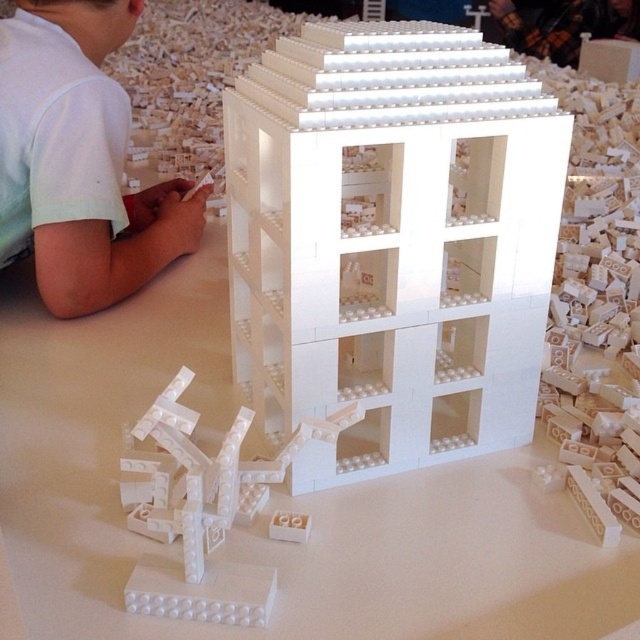
Question: Which point is closer to the camera?

Choices:
 (A) white plastic building at center
 (B) white matte shirt at upper left

Answer: (A)

Question: Where is white plastic building at center located in relation to white matte shirt at upper left in the image?

Choices:
 (A) below
 (B) above

Answer: (A)

Question: Which of the following is the farthest from the observer?

Choices:
 (A) white matte shirt at upper left
 (B) white plastic building at center

Answer: (A)

Question: Does white plastic building at center appear under white matte shirt at upper left?

Choices:
 (A) no
 (B) yes

Answer: (B)

Question: Is white plastic building at center wider than white matte shirt at upper left?

Choices:
 (A) no
 (B) yes

Answer: (B)